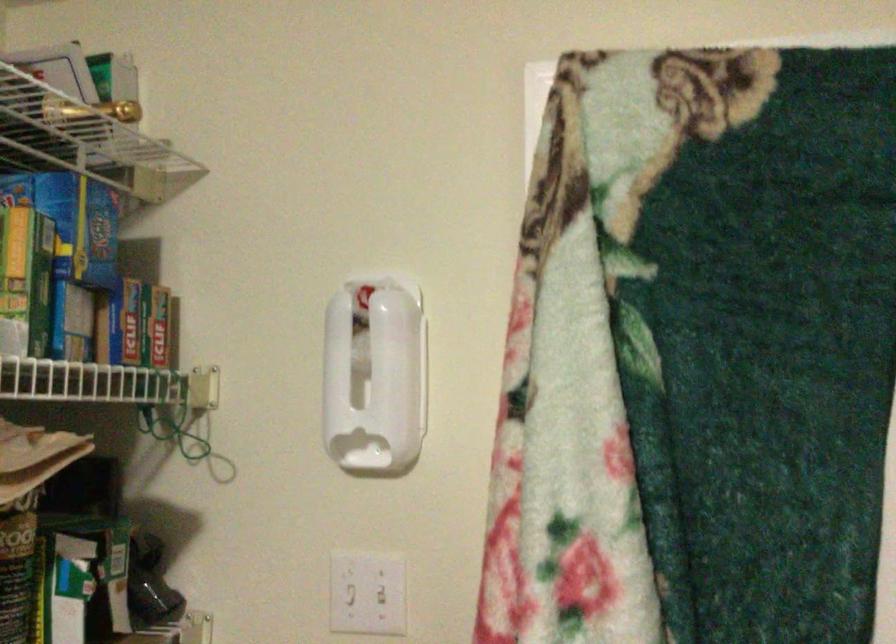
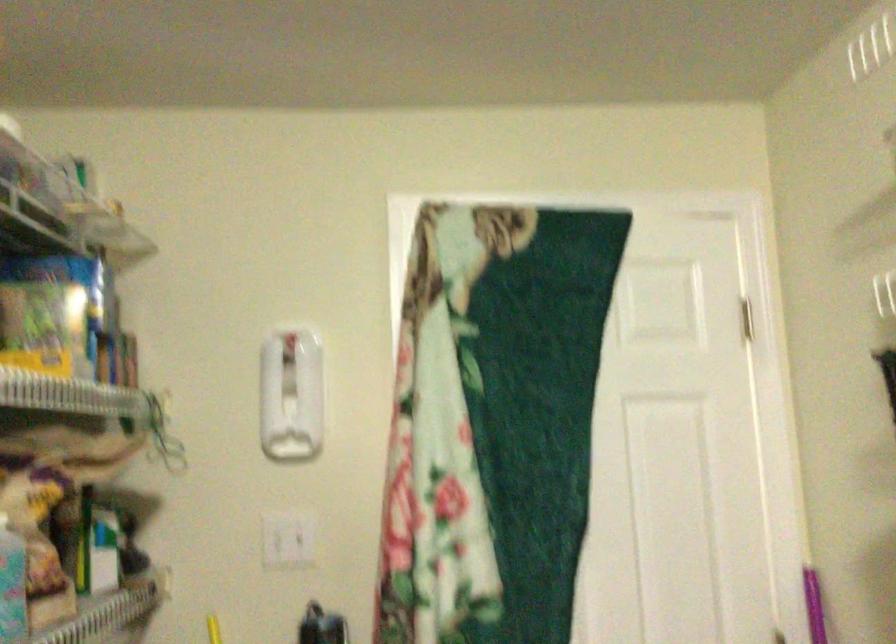
What movement of the cameraman would produce the second image?

The cameraman moved toward left, backward.